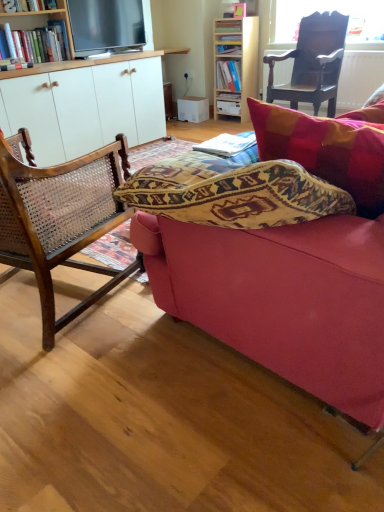
Question: From the image's perspective, is hardcover book at upper center, which ranks as the 4th book in bottom-to-top order, under hardcover book at center, the first book when ordered from back to front?

Choices:
 (A) yes
 (B) no

Answer: (B)

Question: Could you tell me if hardcover book at upper center, which ranks as the third book in back-to-front order, is facing hardcover book at center, which is the 3th book from top to bottom?

Choices:
 (A) yes
 (B) no

Answer: (B)

Question: Considering the relative positions of hardcover book at upper center, which ranks as the third book in back-to-front order, and hardcover book at center, which is the 3th book from top to bottom, in the image provided, is hardcover book at upper center, which ranks as the third book in back-to-front order, to the right of hardcover book at center, which is the 3th book from top to bottom, from the viewer's perspective?

Choices:
 (A) yes
 (B) no

Answer: (B)

Question: Does hardcover book at upper center, placed as the 1th book when sorted from top to bottom, contain hardcover book at center, which is the 3th book from top to bottom?

Choices:
 (A) yes
 (B) no

Answer: (B)

Question: Does hardcover book at upper center, which ranks as the 4th book in bottom-to-top order, have a larger size compared to hardcover book at center, the 4th book when ordered from front to back?

Choices:
 (A) yes
 (B) no

Answer: (A)

Question: Can you confirm if hardcover book at upper center, acting as the 2th book starting from the front, is wider than hardcover book at center, the second book positioned from the bottom?

Choices:
 (A) no
 (B) yes

Answer: (B)

Question: Does matte blue book at upper center, the second book in the back-to-front sequence, have a lesser width compared to light wood bookcase at upper center?

Choices:
 (A) no
 (B) yes

Answer: (A)

Question: From the image's perspective, is matte blue book at upper center, the second book in the back-to-front sequence, beneath light wood bookcase at upper center?

Choices:
 (A) no
 (B) yes

Answer: (B)

Question: Is matte blue book at upper center, the second book in the back-to-front sequence, far away from light wood bookcase at upper center?

Choices:
 (A) yes
 (B) no

Answer: (B)

Question: From a real-world perspective, is matte blue book at upper center, the second book in the back-to-front sequence, beneath light wood bookcase at upper center?

Choices:
 (A) yes
 (B) no

Answer: (A)

Question: Is matte blue book at upper center, the second book in the back-to-front sequence, smaller than light wood bookcase at upper center?

Choices:
 (A) yes
 (B) no

Answer: (A)

Question: Is matte blue book at upper center, the second book in the back-to-front sequence, bigger than light wood bookcase at upper center?

Choices:
 (A) yes
 (B) no

Answer: (B)

Question: Is wooden cane chair at left, which is counted as the first chair, starting from the left, smaller than light wood bookcase at upper center?

Choices:
 (A) no
 (B) yes

Answer: (A)